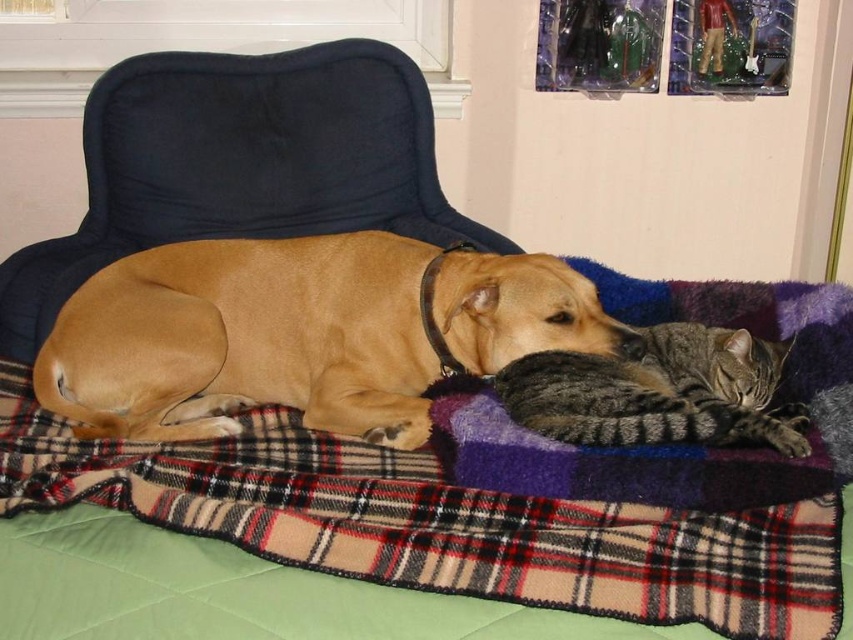
The width and height of the screenshot is (853, 640). I want to click on soft purple fleece cat bed at center, so click(672, 445).

Which is in front, point (749, 296) or point (527, 412)?

Point (527, 412) is in front.

You are a GUI agent. You are given a task and a screenshot of the screen. Output one action in this format:
    pyautogui.click(x=<x>, y=<y>)
    Task: Click on the soft purple fleece cat bed at center
    This screenshot has width=853, height=640.
    Given the screenshot: What is the action you would take?
    pyautogui.click(x=672, y=445)

From the picture: How much distance is there between plaid fabric at center and golden brown fur at center?

plaid fabric at center and golden brown fur at center are 23.04 centimeters apart from each other.

Where is `plaid fabric at center`? This screenshot has height=640, width=853. plaid fabric at center is located at coordinates (440, 524).

Is suede-like tan armchair at upper center bigger than gray striped fur cat at center?

Indeed, suede-like tan armchair at upper center has a larger size compared to gray striped fur cat at center.

Between suede-like tan armchair at upper center and gray striped fur cat at center, which one is positioned lower?

gray striped fur cat at center is lower down.

Which is behind, point (378, 211) or point (634, 339)?

Point (378, 211)

Identify the location of suede-like tan armchair at upper center. (241, 164).